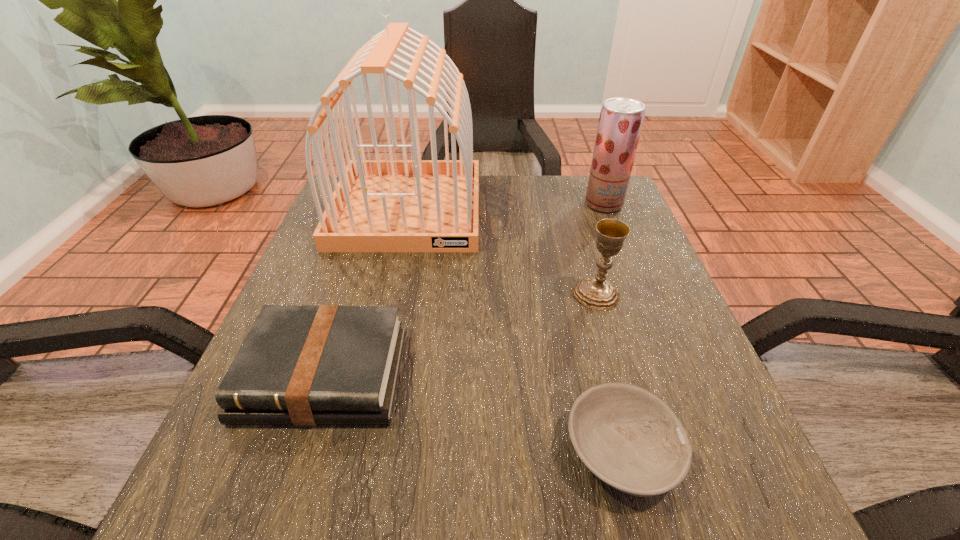
I want to click on the tallest object, so click(417, 205).

The height and width of the screenshot is (540, 960). In order to click on fruit juice in this screenshot , I will do `click(621, 119)`.

The image size is (960, 540). Find the location of `the third shortest object`. the third shortest object is located at coordinates (596, 292).

You are a GUI agent. You are given a task and a screenshot of the screen. Output one action in this format:
    pyautogui.click(x=<x>, y=<y>)
    Task: Click on the third farthest object
    
    Given the screenshot: What is the action you would take?
    pyautogui.click(x=596, y=292)

Where is `the fourth tallest object`? This screenshot has height=540, width=960. the fourth tallest object is located at coordinates (299, 365).

You are a GUI agent. You are given a task and a screenshot of the screen. Output one action in this format:
    pyautogui.click(x=<x>, y=<y>)
    Task: Click on the bowl
    Image resolution: width=960 pixels, height=540 pixels.
    Given the screenshot: What is the action you would take?
    629,438

Locate an element on the screen. This screenshot has height=540, width=960. free location located 0.340m with an open door on the birdcage is located at coordinates (368, 383).

Image resolution: width=960 pixels, height=540 pixels. I want to click on vacant region located 0.130m on the front of the fruit juice, so click(x=621, y=247).

At what (x,y) coordinates should I click in order to perform the action: click on free location located 0.280m on the front of the third shortest object. Please return your answer as a coordinate pair (x, y). Looking at the image, I should click on click(x=642, y=453).

Identify the location of free space located 0.080m on the spine side of the hardback book. This screenshot has width=960, height=540. (289, 484).